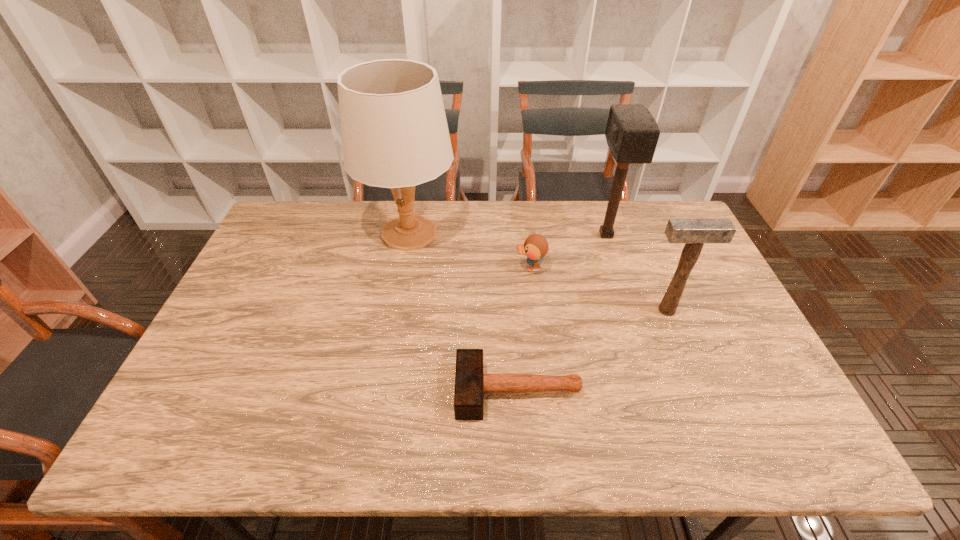
Identify the location of vacant point located between the nearest object and the third shortest object. The height and width of the screenshot is (540, 960). (592, 350).

This screenshot has height=540, width=960. I want to click on vacant region between the duck and the farthest mallet, so click(x=568, y=251).

Identify the location of vacant space that is in between the fourth farthest object and the fourth tallest object. (598, 289).

Identify the location of empty location between the shortest object and the tallest mallet. The width and height of the screenshot is (960, 540). (562, 313).

You are a GUI agent. You are given a task and a screenshot of the screen. Output one action in this format:
    pyautogui.click(x=<x>, y=<y>)
    Task: Click on the unoccupied position between the table lamp and the farthest mallet
    This screenshot has width=960, height=540.
    Given the screenshot: What is the action you would take?
    pyautogui.click(x=508, y=234)

This screenshot has height=540, width=960. I want to click on unoccupied position between the table lamp and the second tallest object, so click(x=508, y=234).

Find the location of a particular element. free space between the second shortest object and the second tallest mallet is located at coordinates (598, 289).

This screenshot has width=960, height=540. Identify the location of vacant space that's between the fourth farthest object and the nearest object. (592, 350).

You are a GUI agent. You are given a task and a screenshot of the screen. Output one action in this format:
    pyautogui.click(x=<x>, y=<y>)
    Task: Click on the unoccupied position between the leftmost mallet and the farthest mallet
    The width and height of the screenshot is (960, 540).
    Given the screenshot: What is the action you would take?
    pyautogui.click(x=562, y=313)

Select which object appears as the third closest to the shortest mallet. Please provide its 2D coordinates. Your answer should be formatted as a tuple, i.e. [(x, y)], where the tuple contains the x and y coordinates of a point satisfying the conditions above.

[(394, 131)]